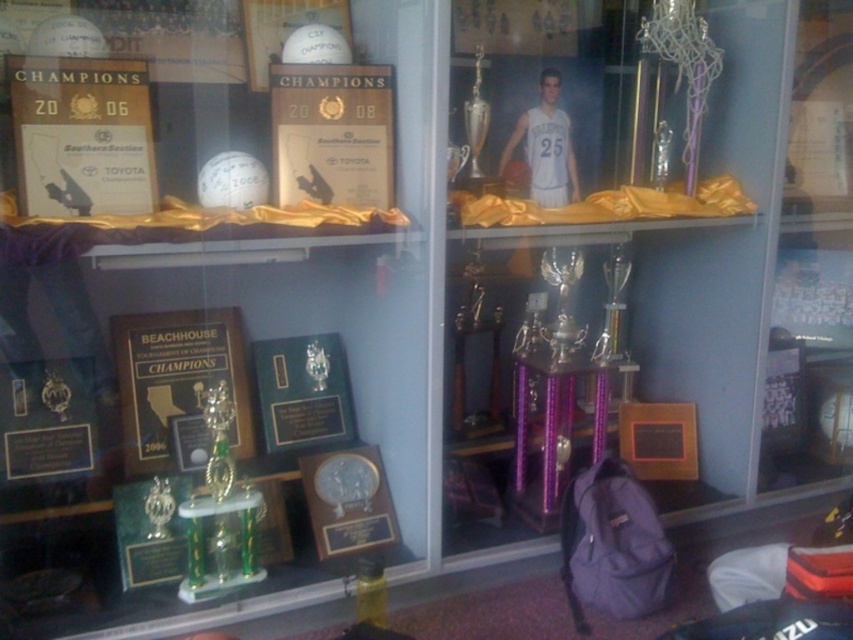
You are a curator organizing the display case. You need to ensure that the white glossy plaque at upper center and the purple metallic trophy at center are visible to visitors. Considering their heights, which object might require adjustment to ensure it isn not obscured?

The white glossy plaque at upper center has a lesser height compared to purple metallic trophy at center, so it might be obscured by the taller trophy. Adjusting the position of the purple metallic trophy at center or raising the plaque could help ensure visibility.

You are standing in front of the display case and need to locate two specific points. The first point is at coordinates point (38, 176) and the second is at point (283, 380). Which point is closer to you?

Point (38, 176) is in front of point (283, 380), so it is closer to you.